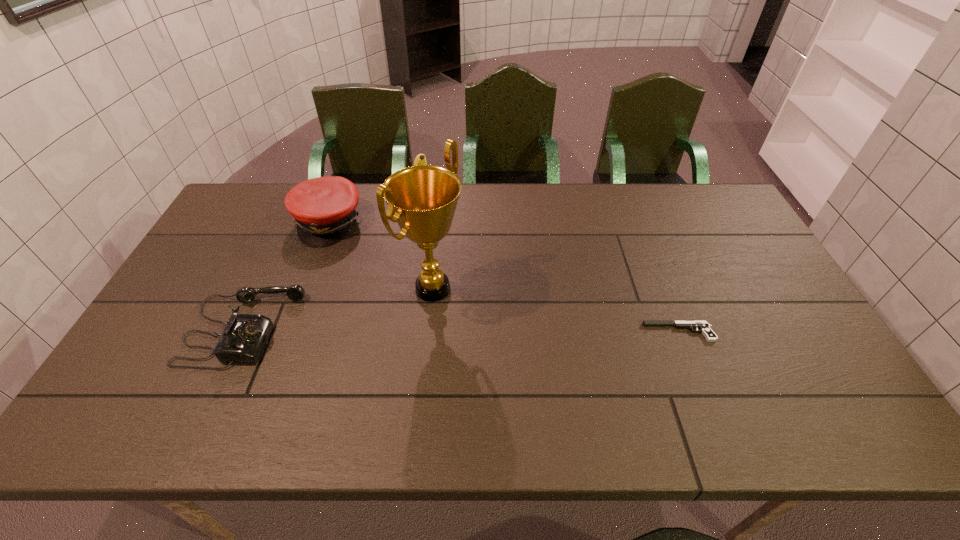
This screenshot has height=540, width=960. Find the location of `vacant area situated 0.360m on the front view with handles of the tallest object`. vacant area situated 0.360m on the front view with handles of the tallest object is located at coordinates (577, 371).

This screenshot has height=540, width=960. Find the location of `vacant point located on the front view with handles of the tallest object`. vacant point located on the front view with handles of the tallest object is located at coordinates (521, 340).

Find the location of `free spot located on the front view with handles of the tallest object`. free spot located on the front view with handles of the tallest object is located at coordinates (592, 379).

Where is `vacant space located 0.320m from the stem of the second tallest object`? The image size is (960, 540). vacant space located 0.320m from the stem of the second tallest object is located at coordinates (457, 266).

Where is `vacant space located from the stem of the second tallest object`? The width and height of the screenshot is (960, 540). vacant space located from the stem of the second tallest object is located at coordinates (452, 255).

Locate an element on the screen. The height and width of the screenshot is (540, 960). vacant region located 0.060m from the stem of the second tallest object is located at coordinates (431, 216).

The height and width of the screenshot is (540, 960). In order to click on vacant space positioned on the front-facing side of the cap in this screenshot , I will do `click(409, 287)`.

Where is `vacant position located 0.080m on the front-facing side of the cap`? vacant position located 0.080m on the front-facing side of the cap is located at coordinates pyautogui.click(x=363, y=251).

Find the location of a particular element. The image size is (960, 540). vacant position located 0.240m on the front-facing side of the cap is located at coordinates (396, 277).

You are a GUI agent. You are given a task and a screenshot of the screen. Output one action in this format:
    pyautogui.click(x=<x>, y=<y>)
    Task: Click on the banana located at the far edge
    This screenshot has width=960, height=540.
    Given the screenshot: What is the action you would take?
    pyautogui.click(x=420, y=159)